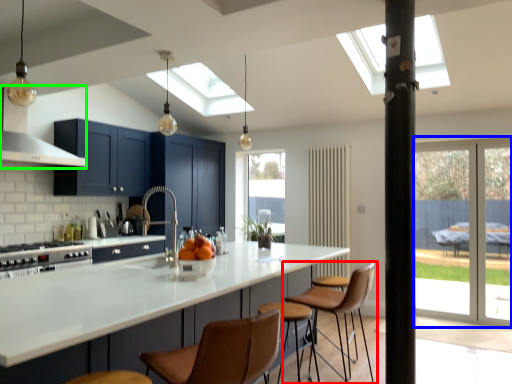
Question: Which object is the farthest from chair (highlighted by a red box)? Choose among these: screen door (highlighted by a blue box) or exhaust hood (highlighted by a green box).

Choices:
 (A) screen door
 (B) exhaust hood

Answer: (B)